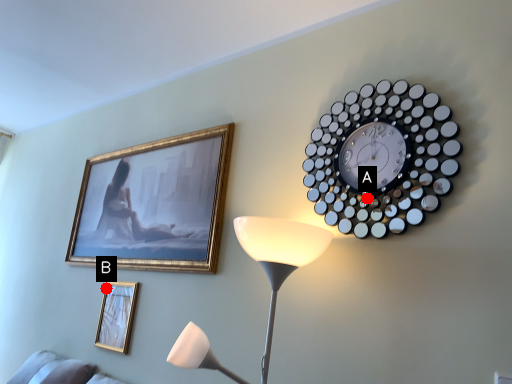
Question: Two points are circled on the image, labeled by A and B beside each circle. Which point is further to the camera?

Choices:
 (A) A is further
 (B) B is further

Answer: (B)